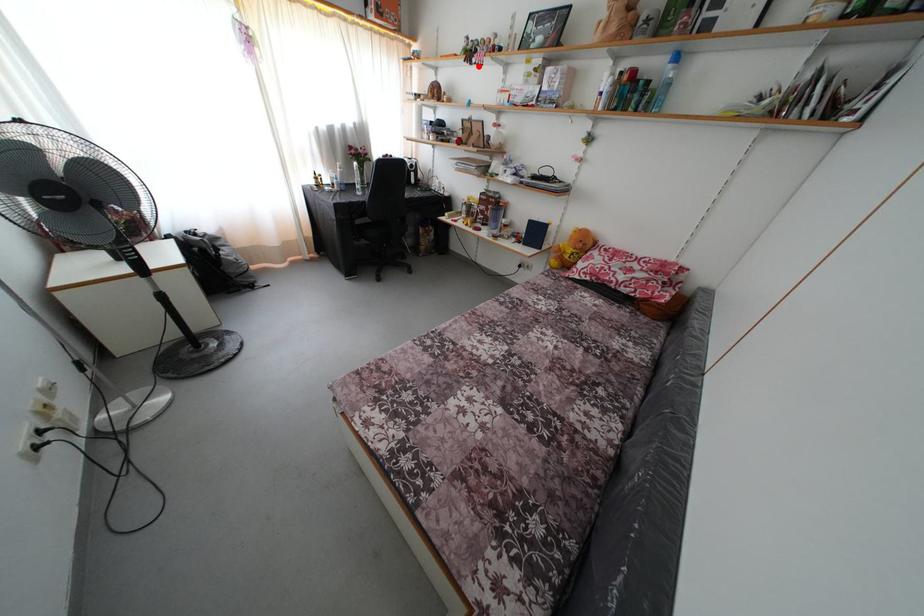
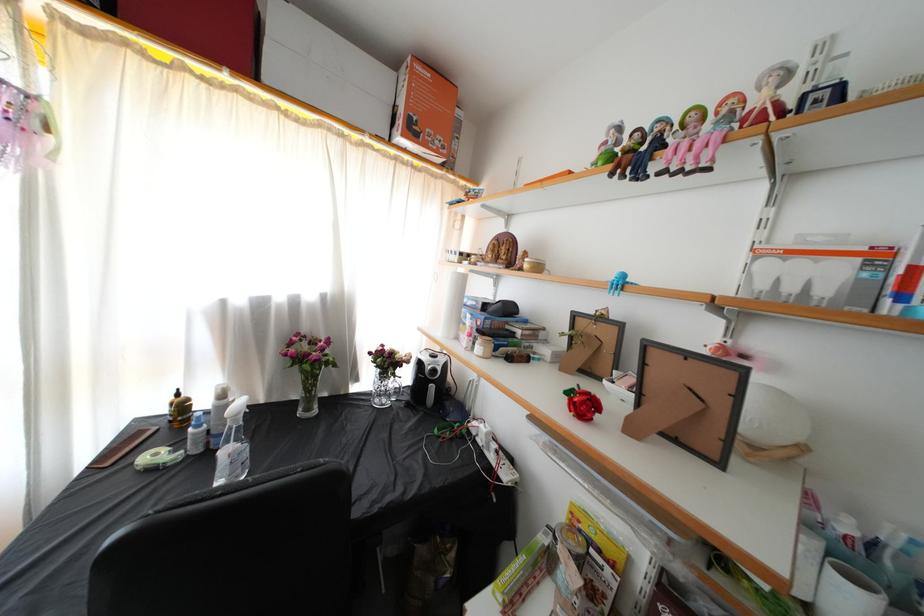
Where in the second image is the point corresponding to the highlighted location from the first image?

(659, 172)